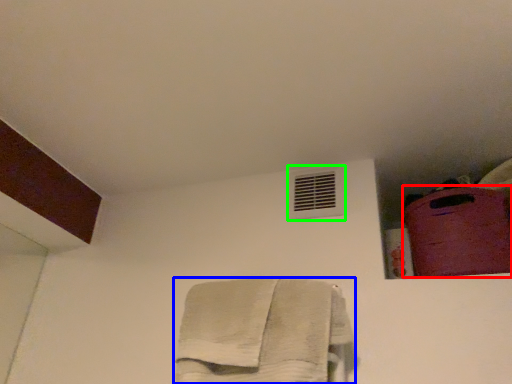
Question: Based on their relative distances, which object is farther from luggage (highlighted by a red box)? Choose from towel (highlighted by a blue box) and air conditioning (highlighted by a green box).

Choices:
 (A) towel
 (B) air conditioning

Answer: (A)